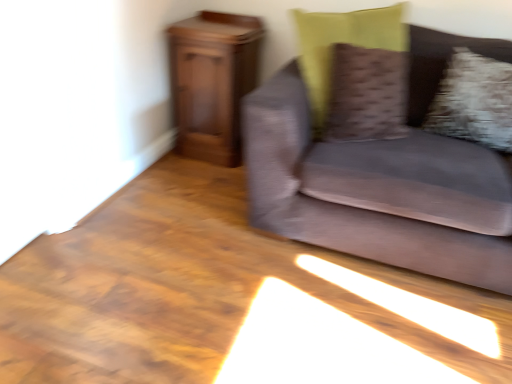
Image resolution: width=512 pixels, height=384 pixels. Find the location of `free space to the left of velvet gray couch at right`. free space to the left of velvet gray couch at right is located at coordinates (166, 249).